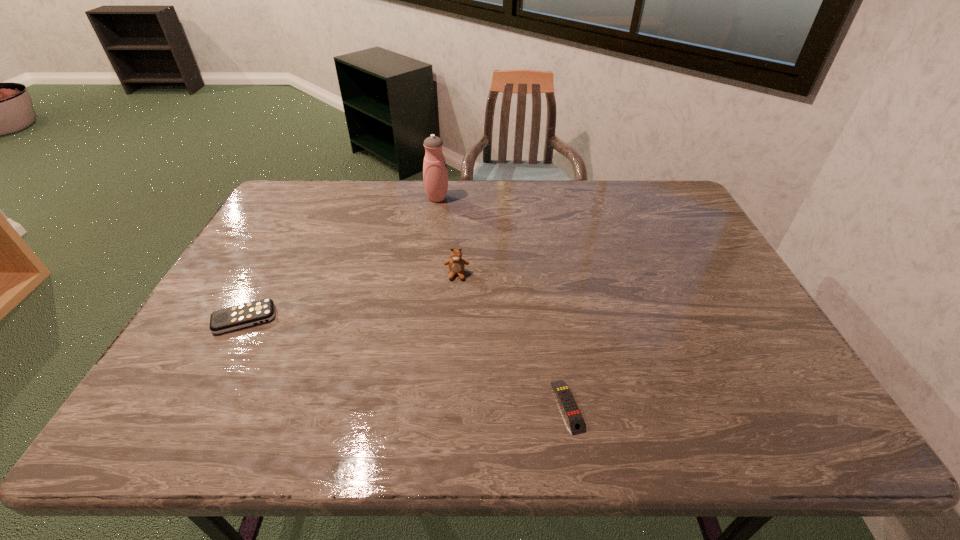
Identify the location of free spot between the thermos bottle and the shorter remote control. Image resolution: width=960 pixels, height=540 pixels. (502, 302).

Locate an element on the screen. The width and height of the screenshot is (960, 540). the closest object relative to the left remote control is located at coordinates (456, 264).

Where is `object that is the second closest one to the second tallest object`? This screenshot has height=540, width=960. object that is the second closest one to the second tallest object is located at coordinates (574, 418).

You are a GUI agent. You are given a task and a screenshot of the screen. Output one action in this format:
    pyautogui.click(x=<x>, y=<y>)
    Task: Click on the free space that satisfies the following two spatial constraints: 1. on the front-facing side of the right remote control; 2. on the left side of the teddy bear
    The image size is (960, 540).
    Given the screenshot: What is the action you would take?
    pyautogui.click(x=449, y=406)

Where is `free space that satisfies the following two spatial constraints: 1. on the front-facing side of the right remote control; 2. on the right side of the second tallest object`? This screenshot has width=960, height=540. free space that satisfies the following two spatial constraints: 1. on the front-facing side of the right remote control; 2. on the right side of the second tallest object is located at coordinates (449, 406).

I want to click on vacant space that satisfies the following two spatial constraints: 1. on the front side of the third farthest object; 2. on the left side of the rightmost object, so click(198, 406).

You are a GUI agent. You are given a task and a screenshot of the screen. Output one action in this format:
    pyautogui.click(x=<x>, y=<y>)
    Task: Click on the free space in the image that satisfies the following two spatial constraints: 1. on the front-facing side of the rightmost object; 2. on the left side of the teddy bear
    This screenshot has width=960, height=540.
    Given the screenshot: What is the action you would take?
    pyautogui.click(x=449, y=406)

This screenshot has width=960, height=540. I want to click on free region that satisfies the following two spatial constraints: 1. on the front-facing side of the nearer remote control; 2. on the right side of the third nearest object, so click(449, 406).